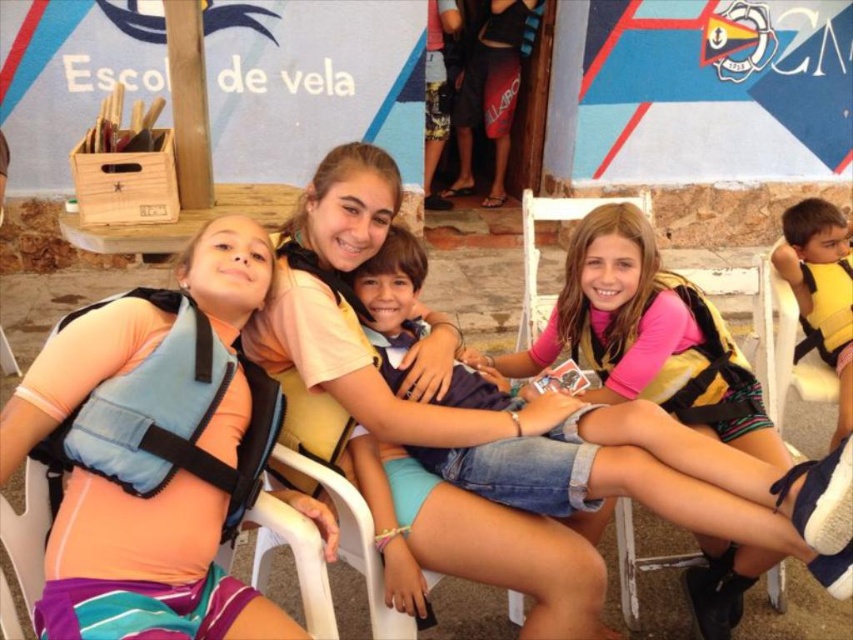
Question: Which of the following is the farthest from the observer?

Choices:
 (A) yellow life vest at lower right
 (B) yellow life vest at center

Answer: (A)

Question: Is yellow life vest at center further to the viewer compared to yellow life vest at lower right?

Choices:
 (A) yes
 (B) no

Answer: (B)

Question: Can you confirm if yellow life vest at center is positioned to the right of yellow life vest at lower right?

Choices:
 (A) yes
 (B) no

Answer: (B)

Question: Does yellow life vest at center appear on the right side of yellow life vest at lower right?

Choices:
 (A) no
 (B) yes

Answer: (A)

Question: Which of the following is the closest to the observer?

Choices:
 (A) (828, 246)
 (B) (817, 557)

Answer: (B)